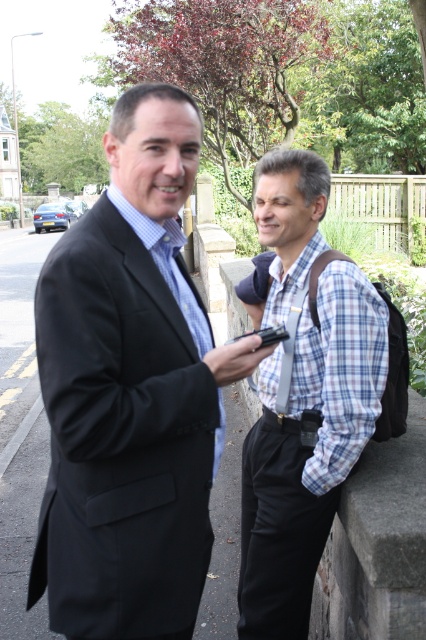
Based on the scene description, which object is taller between the black suit at left and the plaid fabric shirt at center?

The plaid fabric shirt at center is taller than the black suit at left.

You are standing at the origin point in the image. Which direction should you move to reach the black suit at left?

The black suit at left is located at coordinates 0.614 on the x axis and 0.308 on the y axis. To reach it from the origin, move right along the x axis to 0.614 and up along the y axis to 0.308.

You are standing at the point labeled point (132,404) and want to walk to the point labeled point (264,602). Which direction should you turn to face the direction of your destination?

Since point (132,404) is in front of point (264,602), you should turn around to face the direction of point (264,602).